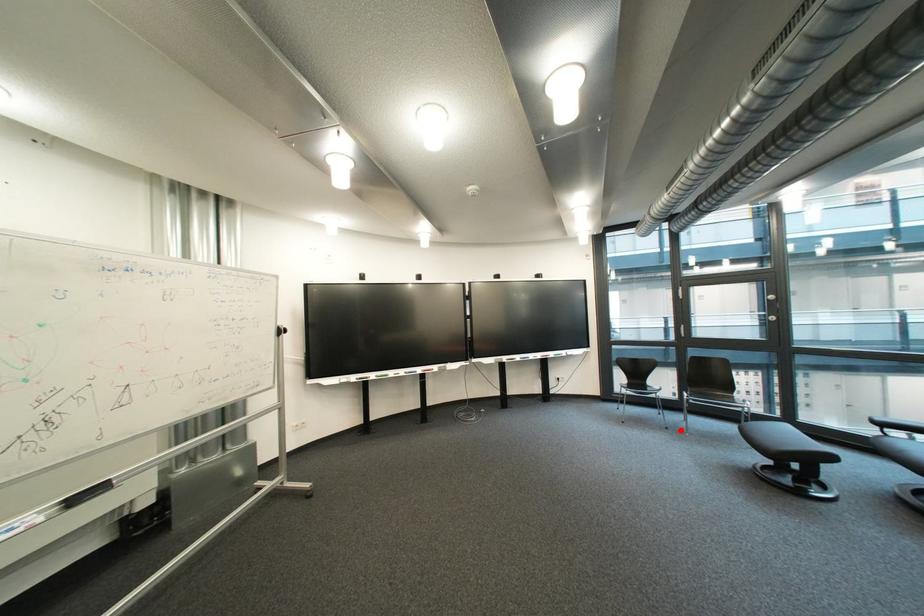
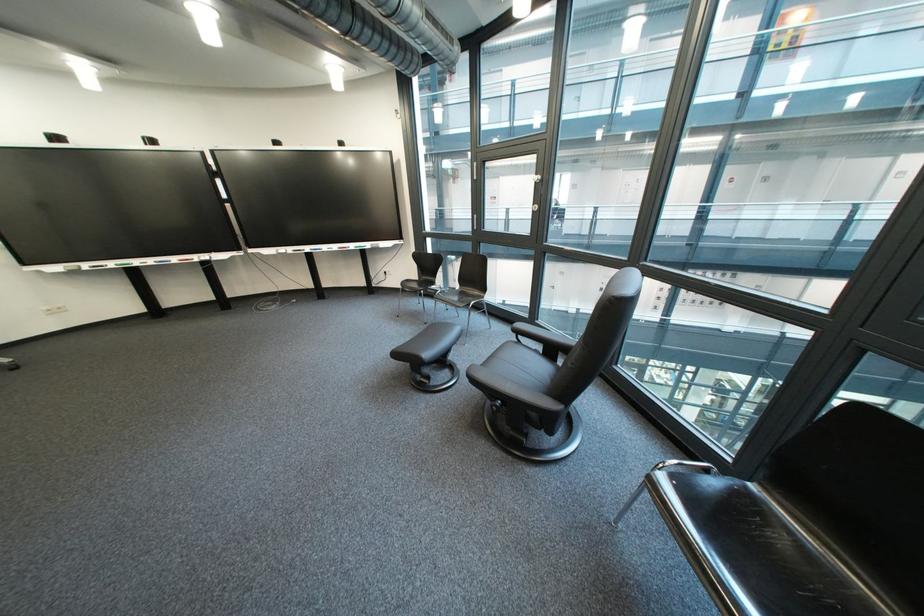
Question: I am providing you with two images of the same scene from different viewpoints. In image1, a red point is highlighted. Considering the same 3D point in image2, which of the following is correct?

Choices:
 (A) It is closer
 (B) It is farther

Answer: (B)